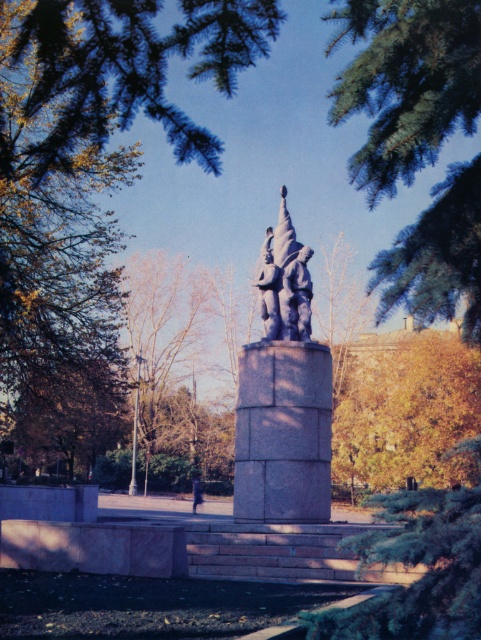
You are standing in the park and want to take a photo of the smooth stone statue at center without any yellow leaves at upper center blocking the view. Is the statue visible from your current position?

The yellow leaves at upper center is much taller than the smooth stone statue at center, so the leaves might block the view of the statue. Move to a position where you can look up to see the statue above the leaves.